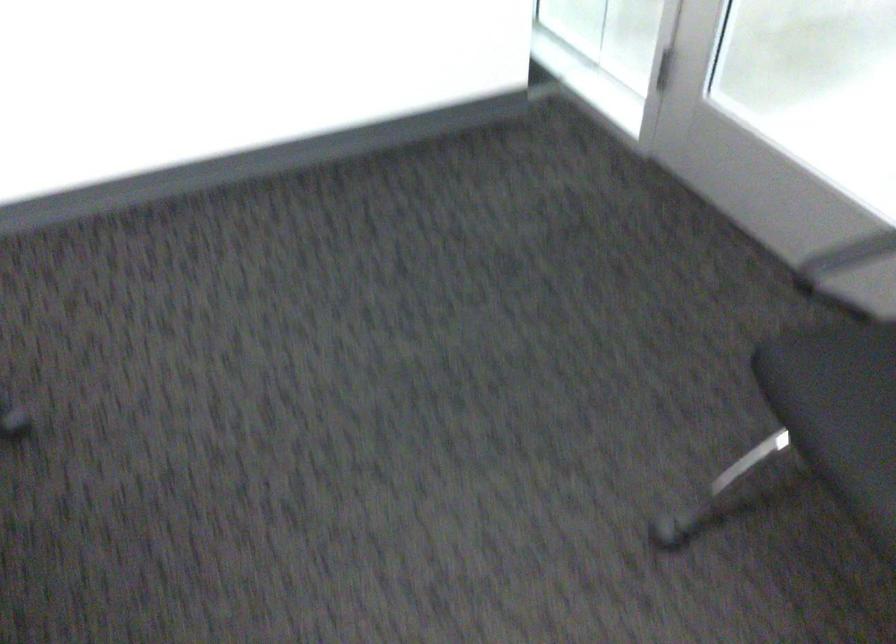
Image resolution: width=896 pixels, height=644 pixels. What do you see at coordinates (839, 410) in the screenshot?
I see `the chair sitting surface` at bounding box center [839, 410].